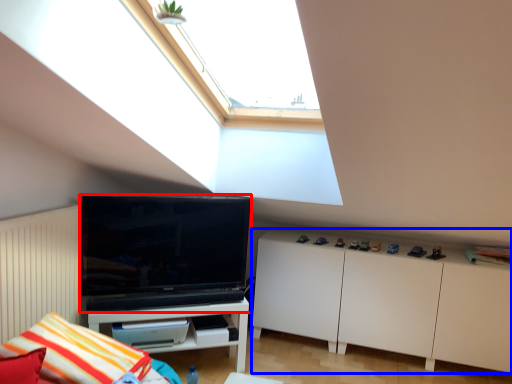
Question: Among these objects, which one is farthest to the camera, television (highlighted by a red box) or cabinetry (highlighted by a blue box)?

Choices:
 (A) television
 (B) cabinetry

Answer: (B)